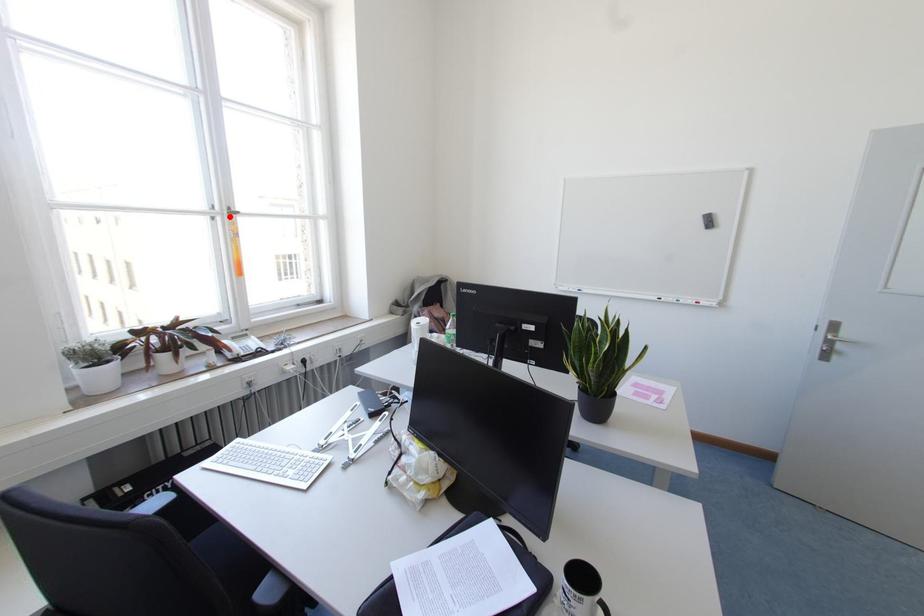
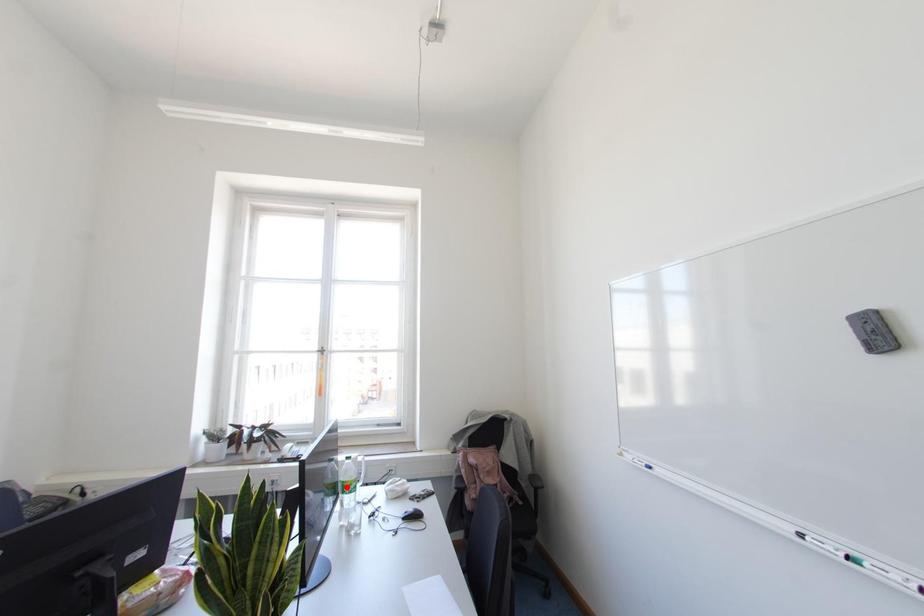
I am providing you with two images of the same scene from different viewpoints. A red point is marked on the first image and another point is marked on the second image. Is the marked point in image1 the same physical position as the marked point in image2?

No